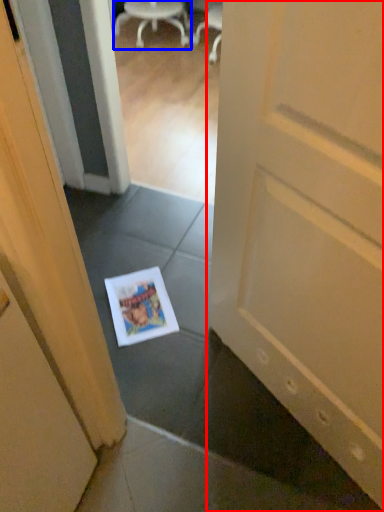
Question: Which point is closer to the camera, door (highlighted by a red box) or chair (highlighted by a blue box)?

Choices:
 (A) door
 (B) chair

Answer: (A)